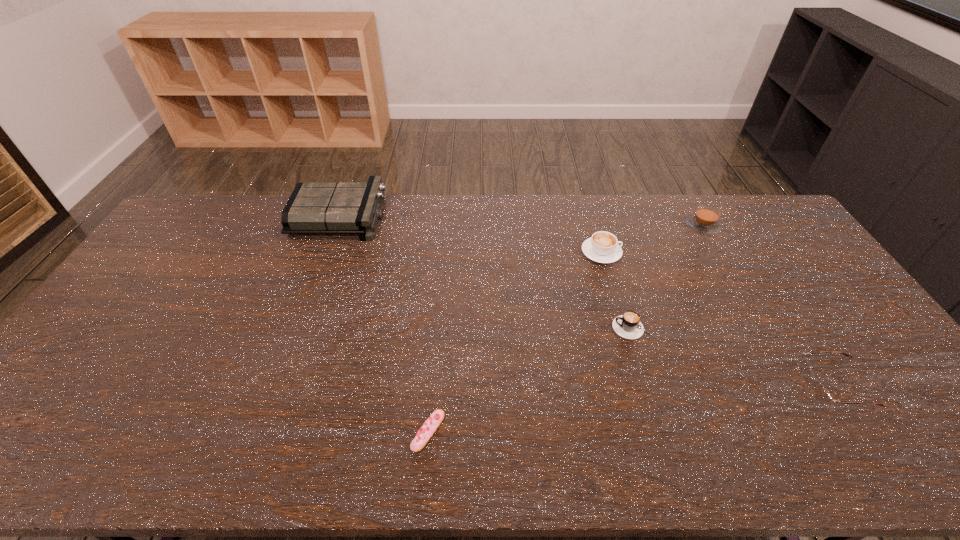
Identify the location of free space between the spectacles and the nearest cappuccino. The height and width of the screenshot is (540, 960). (733, 357).

Find the location of `free space between the second farthest cappuccino and the tallest object`. free space between the second farthest cappuccino and the tallest object is located at coordinates (470, 234).

At what (x,y) coordinates should I click in order to perform the action: click on vacant space that is in between the farthest cappuccino and the nearest cappuccino. Please return your answer as a coordinate pair (x, y). Looking at the image, I should click on (668, 277).

In order to click on empty location between the nearest cappuccino and the eclair in this screenshot , I will do `click(531, 380)`.

Find the location of `vacant area between the spectacles and the second nearest cappuccino`. vacant area between the spectacles and the second nearest cappuccino is located at coordinates (718, 319).

The width and height of the screenshot is (960, 540). What are the coordinates of `vacant space that's between the spectacles and the rightmost cappuccino` in the screenshot? It's located at (768, 306).

I want to click on the fourth closest object to the second farthest cappuccino, so click(430, 426).

Locate which object is the fifth closest to the nearest cappuccino. Please provide its 2D coordinates. Your answer should be formatted as a tuple, i.e. [(x, y)], where the tuple contains the x and y coordinates of a point satisfying the conditions above.

[(313, 208)]

Identify which cappuccino is the nearest to the third nearest object. Please provide its 2D coordinates. Your answer should be formatted as a tuple, i.e. [(x, y)], where the tuple contains the x and y coordinates of a point satisfying the conditions above.

[(602, 247)]

Identify which cappuccino is the nearest to the tallest object. Please provide its 2D coordinates. Your answer should be formatted as a tuple, i.e. [(x, y)], where the tuple contains the x and y coordinates of a point satisfying the conditions above.

[(602, 247)]